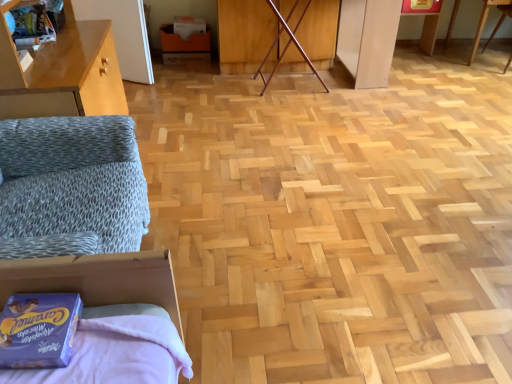
What do you see at coordinates (184, 40) in the screenshot? I see `matte cardboard box at center` at bounding box center [184, 40].

Find the location of `matte cardboard box at center`. matte cardboard box at center is located at coordinates (184, 40).

From the image's perspective, which one is positioned higher, wooden table at upper right or matte cardboard box at center?

matte cardboard box at center.

Between wooden table at upper right and matte cardboard box at center, which one is positioned in front?

wooden table at upper right is closer to the camera.

Considering the sizes of wooden table at upper right and matte cardboard box at center in the image, is wooden table at upper right bigger or smaller than matte cardboard box at center?

Considering their sizes, wooden table at upper right takes up more space than matte cardboard box at center.

Considering their positions, is blue cardboard box at lower left located in front of or behind wooden table at upper right?

blue cardboard box at lower left is positioned closer to the viewer than wooden table at upper right.

Is blue cardboard box at lower left located outside wooden table at upper right?

Yes.

Does blue cardboard box at lower left turn towards wooden table at upper right?

No, blue cardboard box at lower left is not aimed at wooden table at upper right.

From a real-world perspective, who is located lower, blue cardboard box at lower left or wooden table at upper right?

wooden table at upper right.

Does wooden table at upper right have a greater height compared to blue cardboard box at lower left?

Indeed, wooden table at upper right has a greater height compared to blue cardboard box at lower left.

From the image's perspective, is wooden table at upper right above blue cardboard box at lower left?

Yes.

Is wooden table at upper right outside of blue cardboard box at lower left?

Yes, wooden table at upper right is not within blue cardboard box at lower left.

This screenshot has width=512, height=384. Identify the location of table on the right side of blue cardboard box at lower left. (485, 22).

Is blue cardboard box at lower left taller than matte cardboard box at center?

In fact, blue cardboard box at lower left may be shorter than matte cardboard box at center.

From a real-world perspective, which is physically below, blue cardboard box at lower left or matte cardboard box at center?

matte cardboard box at center, from a real-world perspective.

Would you say blue cardboard box at lower left is to the left or to the right of matte cardboard box at center in the picture?

Clearly, blue cardboard box at lower left is on the right of matte cardboard box at center in the image.

Identify the location of package on the right side of matte cardboard box at center. (39, 330).

Between matte cardboard box at center and wooden table at upper right, which one has smaller size?

matte cardboard box at center.

Based on the photo, can you confirm if matte cardboard box at center is thinner than wooden table at upper right?

Indeed, matte cardboard box at center has a lesser width compared to wooden table at upper right.

Between matte cardboard box at center and wooden table at upper right, which one appears on the right side from the viewer's perspective?

Positioned to the right is wooden table at upper right.

How different are the orientations of matte cardboard box at center and wooden table at upper right in degrees?

171 degrees.

Is matte cardboard box at center far from blue cardboard box at lower left?

Yes.

From a real-world perspective, is matte cardboard box at center on top of blue cardboard box at lower left?

No.

Considering the relative positions of matte cardboard box at center and blue cardboard box at lower left in the image provided, is matte cardboard box at center to the left of blue cardboard box at lower left from the viewer's perspective?

Indeed, matte cardboard box at center is positioned on the left side of blue cardboard box at lower left.

Which object is closer to the camera taking this photo, matte cardboard box at center or blue cardboard box at lower left?

blue cardboard box at lower left is more forward.

The height and width of the screenshot is (384, 512). Identify the location of table that is in front of the matte cardboard box at center. (485, 22).

Find the location of a particular element. The height and width of the screenshot is (384, 512). table below the blue cardboard box at lower left (from a real-world perspective) is located at coordinates (485, 22).

From the image, which object appears to be nearer to blue cardboard box at lower left, wooden table at upper right or matte cardboard box at center?

matte cardboard box at center.

Which object lies nearer to the anchor point matte cardboard box at center, blue cardboard box at lower left or wooden table at upper right?

The object closer to matte cardboard box at center is wooden table at upper right.

Based on their spatial positions, is blue cardboard box at lower left or matte cardboard box at center closer to wooden table at upper right?

The object closer to wooden table at upper right is matte cardboard box at center.

Based on their spatial positions, is matte cardboard box at center or blue cardboard box at lower left further from wooden table at upper right?

Based on the image, blue cardboard box at lower left appears to be further to wooden table at upper right.

When comparing their distances from matte cardboard box at center, does wooden table at upper right or blue cardboard box at lower left seem further?

blue cardboard box at lower left is positioned further to the anchor matte cardboard box at center.

Which object lies nearer to the anchor point blue cardboard box at lower left, matte cardboard box at center or wooden table at upper right?

matte cardboard box at center is positioned closer to the anchor blue cardboard box at lower left.

Locate an element on the screen. This screenshot has width=512, height=384. package between matte cardboard box at center and wooden table at upper right is located at coordinates (39, 330).